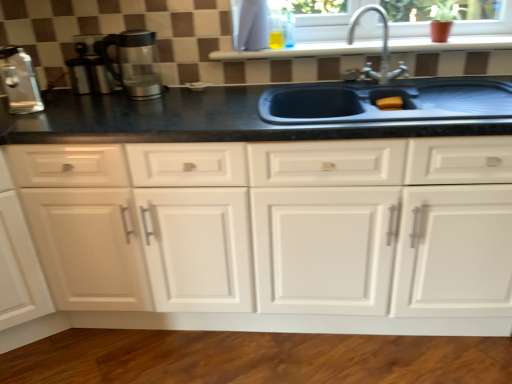
Question: Considering the relative sizes of white glossy window sill at upper center and transparent glass coffee maker at left, which is the first coffee machine from right to left, in the image provided, is white glossy window sill at upper center smaller than transparent glass coffee maker at left, which is the first coffee machine from right to left,?

Choices:
 (A) no
 (B) yes

Answer: (A)

Question: Is white glossy window sill at upper center at the right side of transparent glass coffee maker at left, which is the first coffee machine from right to left?

Choices:
 (A) yes
 (B) no

Answer: (A)

Question: Could you tell me if white glossy window sill at upper center is turned towards transparent glass coffee maker at left, which is the first coffee machine from right to left?

Choices:
 (A) no
 (B) yes

Answer: (A)

Question: Would you say white glossy window sill at upper center is outside transparent glass coffee maker at left, which is the first coffee machine from right to left?

Choices:
 (A) no
 (B) yes

Answer: (B)

Question: Is white glossy window sill at upper center at the left side of transparent glass coffee maker at left, which is the second coffee machine from left to right?

Choices:
 (A) yes
 (B) no

Answer: (B)

Question: Is point (413, 147) closer or farther from the camera than point (26, 92)?

Choices:
 (A) closer
 (B) farther

Answer: (A)

Question: From the image's perspective, is white matte cabinet at center positioned above or below satin silver coffee machine at left, positioned as the 1th coffee machine in left-to-right order?

Choices:
 (A) above
 (B) below

Answer: (B)

Question: Considering their positions, is white matte cabinet at center located in front of or behind satin silver coffee machine at left, positioned as the 1th coffee machine in left-to-right order?

Choices:
 (A) front
 (B) behind

Answer: (A)

Question: Based on their sizes in the image, would you say white matte cabinet at center is bigger or smaller than satin silver coffee machine at left, the second coffee machine viewed from the right?

Choices:
 (A) big
 (B) small

Answer: (A)

Question: Is white glossy window sill at upper center in front of or behind white matte cabinet at center in the image?

Choices:
 (A) front
 (B) behind

Answer: (B)

Question: In terms of width, does white glossy window sill at upper center look wider or thinner when compared to white matte cabinet at center?

Choices:
 (A) wide
 (B) thin

Answer: (B)

Question: Considering the positions of point (309, 46) and point (181, 196), is point (309, 46) closer or farther from the camera than point (181, 196)?

Choices:
 (A) closer
 (B) farther

Answer: (B)

Question: From their relative heights in the image, would you say white glossy window sill at upper center is taller or shorter than white matte cabinet at center?

Choices:
 (A) short
 (B) tall

Answer: (A)

Question: Looking at their shapes, would you say white glossy window sill at upper center is wider or thinner than transparent glass coffee maker at left, which is the second coffee machine from left to right?

Choices:
 (A) thin
 (B) wide

Answer: (B)

Question: In terms of height, does white glossy window sill at upper center look taller or shorter compared to transparent glass coffee maker at left, which is the second coffee machine from left to right?

Choices:
 (A) tall
 (B) short

Answer: (B)